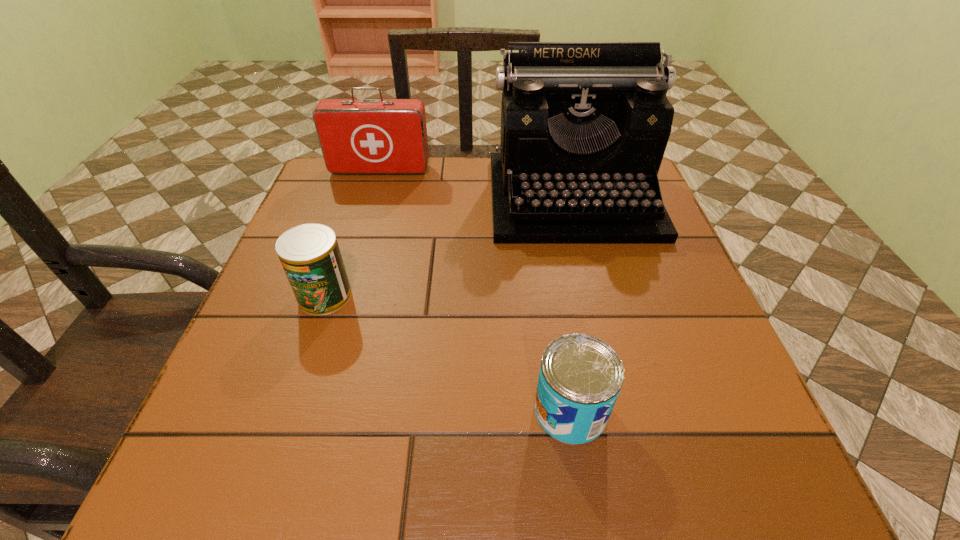
I want to click on vacant region at the left edge, so click(322, 210).

In the image, there is a desktop. Find the location of `vacant space at the right edge`. vacant space at the right edge is located at coordinates (675, 381).

The width and height of the screenshot is (960, 540). I want to click on vacant space at the far left corner of the desktop, so click(x=374, y=177).

In order to click on unoccupied position between the tallest object and the first-aid kit in this screenshot , I will do `click(476, 184)`.

Where is `free space between the tallest object and the second nearest object`? The image size is (960, 540). free space between the tallest object and the second nearest object is located at coordinates (448, 247).

You are a GUI agent. You are given a task and a screenshot of the screen. Output one action in this format:
    pyautogui.click(x=<x>, y=<y>)
    Task: Click on the free area in between the first-aid kit and the nearest object
    
    Given the screenshot: What is the action you would take?
    pyautogui.click(x=475, y=290)

The image size is (960, 540). Identify the location of blank region between the farther can and the first-aid kit. (352, 233).

Identify the location of empty location between the typewriter and the shortest object. (571, 304).

The image size is (960, 540). Identify the location of free space between the first-aid kit and the nearer can. (475, 290).

Locate an element on the screen. vacant space that's between the farther can and the nearest object is located at coordinates (447, 353).